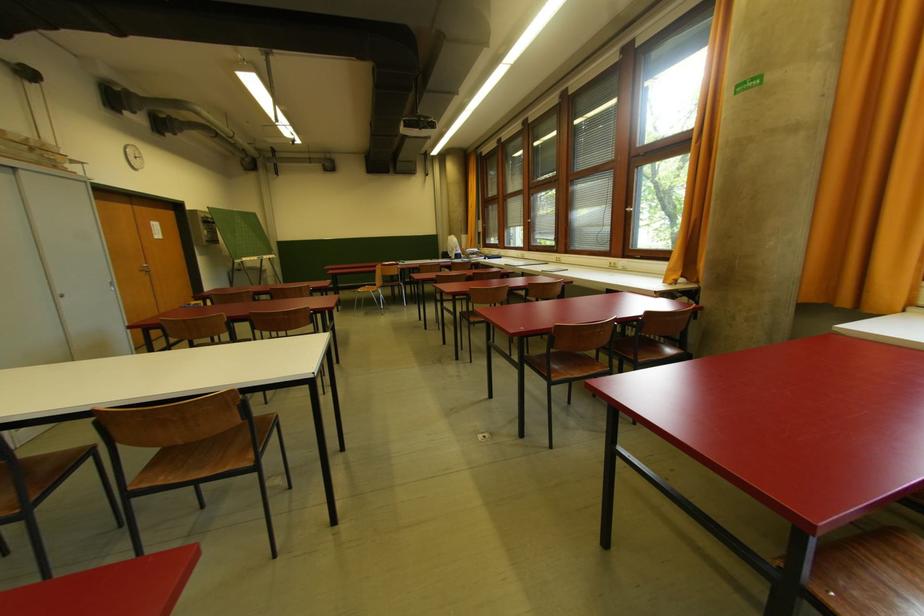
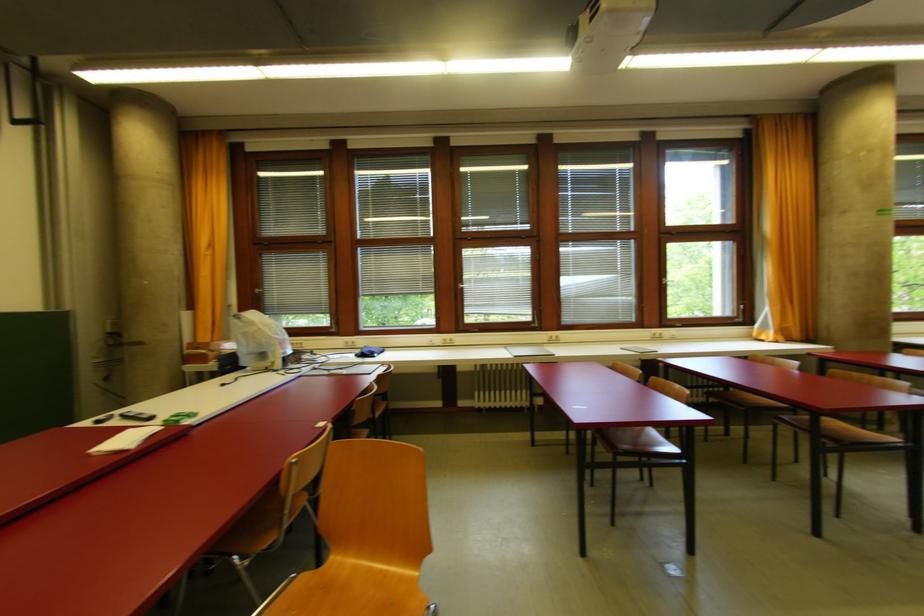
Locate, in the second image, the point that corresponds to [561,261] in the first image.

(556, 339)